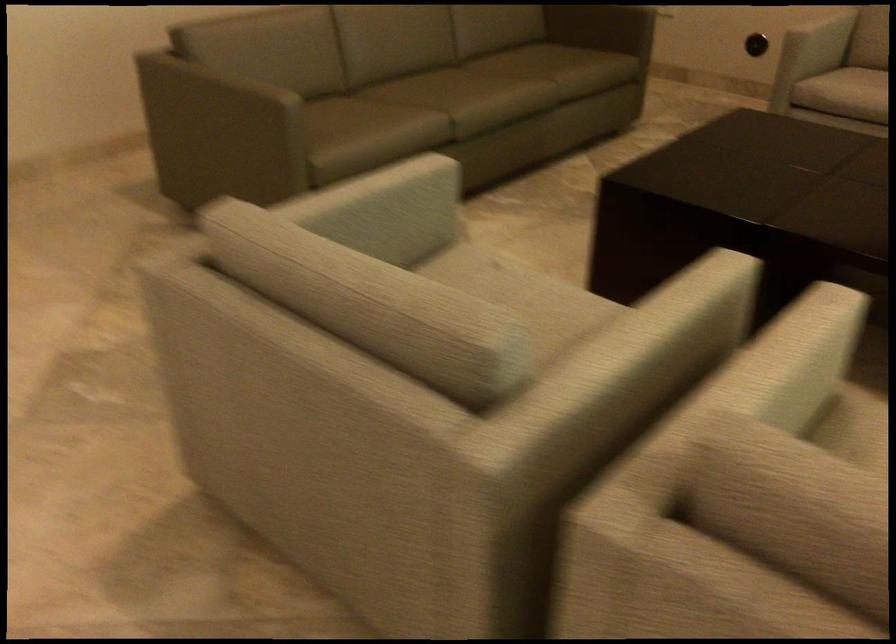
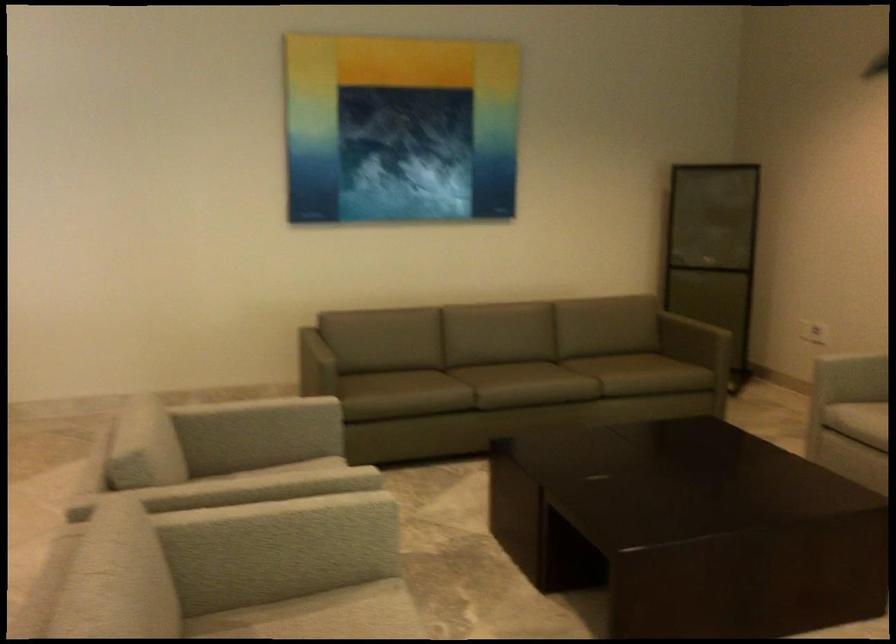
Question: I am providing you with two images of the same scene from different viewpoints. Which of the following objects are not visible in image2?

Choices:
 (A) sofa armrest
 (B) light gray chair armrest
 (C) urn side handle
 (D) chair sitting surface

Answer: (D)